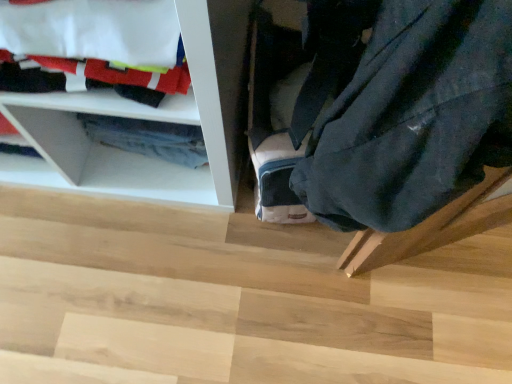
The image size is (512, 384). Find the location of `free area below white fabric at upper left (from a real-world perspective)`. free area below white fabric at upper left (from a real-world perspective) is located at coordinates (151, 182).